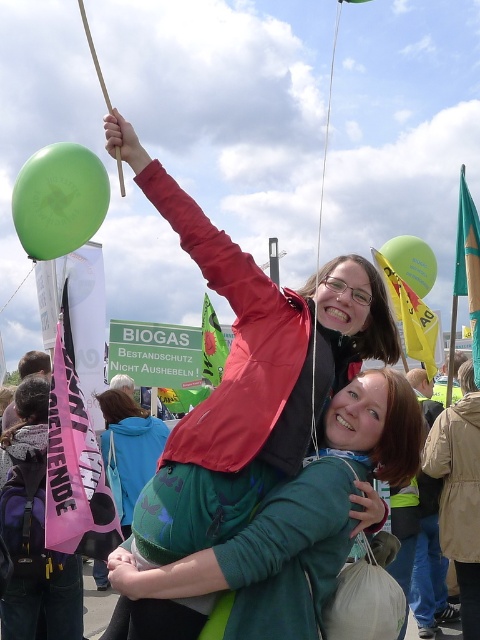
Can you confirm if green fabric jacket at upper center is taller than green rubber balloon at upper left?

In fact, green fabric jacket at upper center may be shorter than green rubber balloon at upper left.

Can you confirm if green fabric jacket at upper center is positioned to the left of green rubber balloon at upper left?

In fact, green fabric jacket at upper center is to the right of green rubber balloon at upper left.

Does point (389, 445) come in front of point (76, 225)?

Yes, point (389, 445) is closer to viewer.

This screenshot has height=640, width=480. Find the location of `green fabric jacket at upper center`. green fabric jacket at upper center is located at coordinates (296, 520).

Is green rubber balloon at upper left shorter than matte green hoodie at center?

Incorrect, green rubber balloon at upper left's height does not fall short of matte green hoodie at center's.

Is point (38, 256) positioned behind point (139, 461)?

No, (38, 256) is in front of (139, 461).

Where is `green rubber balloon at upper left`? Image resolution: width=480 pixels, height=640 pixels. green rubber balloon at upper left is located at coordinates (59, 198).

Describe the element at coordinates (296, 520) in the screenshot. I see `green fabric jacket at upper center` at that location.

Is point (337, 508) closer to camera compared to point (425, 252)?

Yes, point (337, 508) is closer to viewer.

In order to click on green fabric jacket at upper center in this screenshot , I will do `click(296, 520)`.